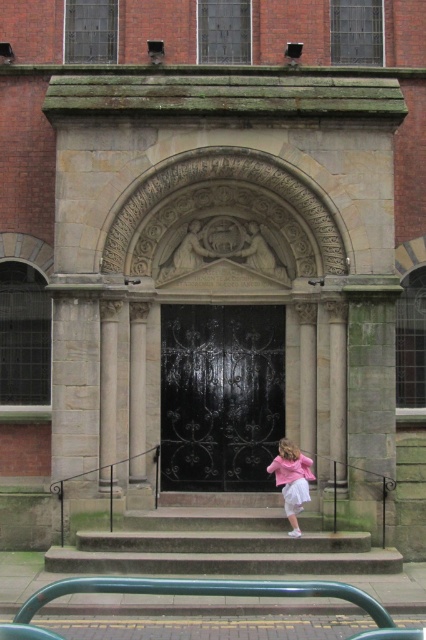
Is smooth stone stairs at center below pink satin dress at lower right?

Yes.

Who is lower down, smooth stone stairs at center or pink satin dress at lower right?

smooth stone stairs at center is lower down.

The width and height of the screenshot is (426, 640). Describe the element at coordinates (221, 545) in the screenshot. I see `smooth stone stairs at center` at that location.

This screenshot has width=426, height=640. Identify the location of smooth stone stairs at center. (221, 545).

Is smooth stone stairs at center bigger than white satin ballet skirt at lower center?

Correct, smooth stone stairs at center is larger in size than white satin ballet skirt at lower center.

Is point (293, 566) more distant than point (305, 490)?

No, (293, 566) is in front of (305, 490).

At what (x,y) coordinates should I click in order to perform the action: click on smooth stone stairs at center. Please return your answer as a coordinate pair (x, y). This screenshot has height=640, width=426. Looking at the image, I should click on (221, 545).

Identify the location of smooth stone stairs at center. The width and height of the screenshot is (426, 640). (221, 545).

Can you confirm if green painted metal rail at lower center is positioned below pink satin dress at lower right?

Yes.

Is point (123, 580) positioned before point (276, 477)?

Yes, it is.

Identify the location of green painted metal rail at lower center. (213, 593).